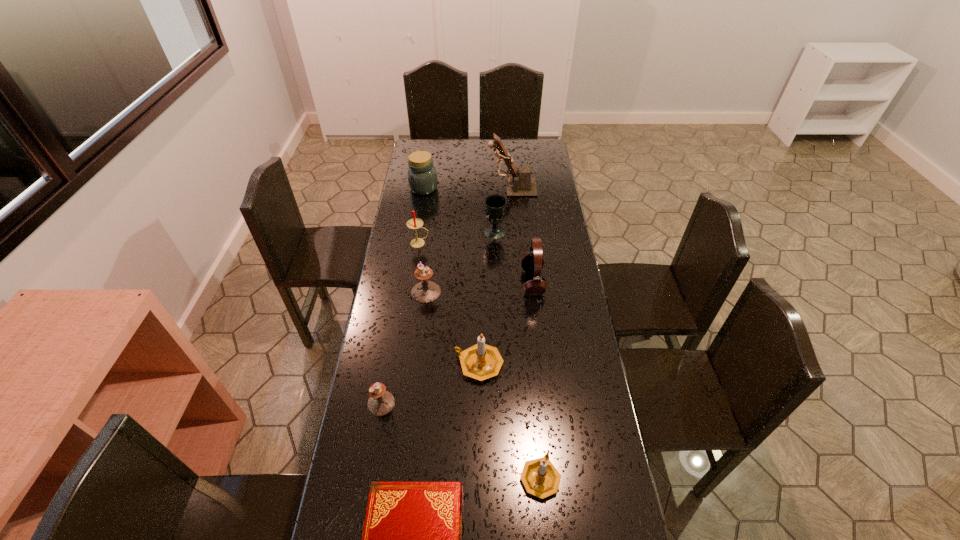
At what (x,y) coordinates should I click in order to perform the action: click on headset at the right edge. Please return your answer as a coordinate pair (x, y). The image size is (960, 540). Looking at the image, I should click on (532, 262).

The image size is (960, 540). I want to click on candle holder at the right edge, so click(540, 478).

Where is `vacant region at the left edge of the desktop`? This screenshot has width=960, height=540. vacant region at the left edge of the desktop is located at coordinates (391, 263).

Find the location of a particular element. vacant area at the right edge is located at coordinates (569, 370).

In the image, there is a desktop. At what (x,y) coordinates should I click in order to perform the action: click on free space at the far right corner. Please return your answer as a coordinate pair (x, y). Looking at the image, I should click on (532, 143).

At what (x,y) coordinates should I click in order to perform the action: click on empty space that is in between the figurine and the green jar. Please return your answer as a coordinate pair (x, y). The image size is (960, 540). Looking at the image, I should click on (468, 188).

The width and height of the screenshot is (960, 540). Identify the location of free space between the nearest candle holder and the farther purple candle holder. (483, 384).

What are the coordinates of `free space between the headset and the figurine` in the screenshot? It's located at (522, 235).

Locate an element on the screen. The image size is (960, 540). free space between the rightmost candle holder and the figurine is located at coordinates (526, 332).

Find the location of a particular element. The image size is (960, 540). unoccupied area between the rightmost candle holder and the bigger gold candle holder is located at coordinates (510, 421).